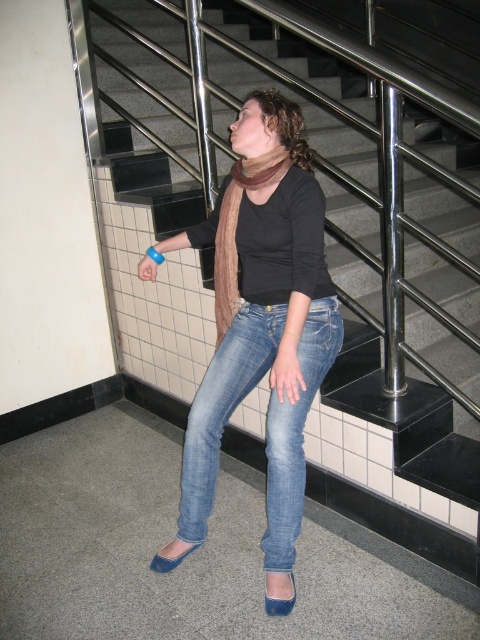
In the scene shown: Does black tile stairs at center lie in front of denim jeans at center?

No, it is not.

Who is higher up, black tile stairs at center or denim jeans at center?

black tile stairs at center is above.

Between point (152, 84) and point (297, 506), which one is positioned behind?

The point (152, 84) is more distant.

This screenshot has width=480, height=640. What are the coordinates of `black tile stairs at center` in the screenshot? It's located at (148, 115).

Who is more distant from viewer, (x=287, y=564) or (x=266, y=161)?

Point (x=266, y=161)

Is point (315, 336) less distant than point (264, 179)?

That is False.

Which is behind, point (269, 532) or point (230, 209)?

The point (230, 209) is behind.

Where is `denim jeans at center`? Image resolution: width=480 pixels, height=640 pixels. denim jeans at center is located at coordinates (223, 406).

Is the position of black tile stairs at center less distant than that of blue rubber wristband at upper center?

No, black tile stairs at center is further to the viewer.

Is point (468, 214) positioned after point (156, 260)?

Yes, it is.

Where is `black tile stairs at center`? black tile stairs at center is located at coordinates (148, 115).